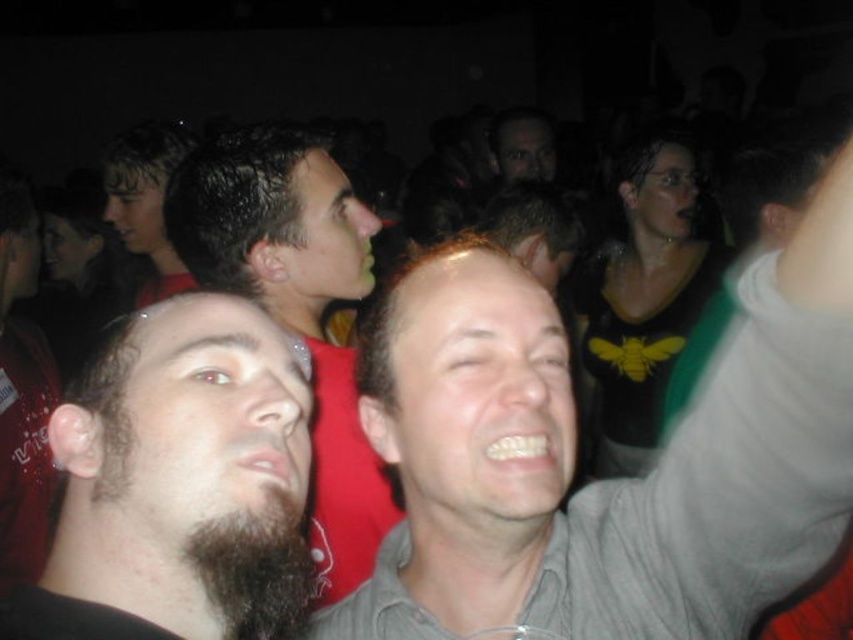
Based on the photo, based on the coordinates provided, can you identify which part of the man on the left is marked by the point at [180,484]?

The point at [180,484] corresponds to the dark brown beard at left.

You are at a party and need to find the dark brown fuzzy beard at lower left. Which direction should you look relative to the black matte shirt at upper right?

The dark brown fuzzy beard at lower left is to the left of the black matte shirt at upper right, so you should look to the left of the black matte shirt at upper right to find it.